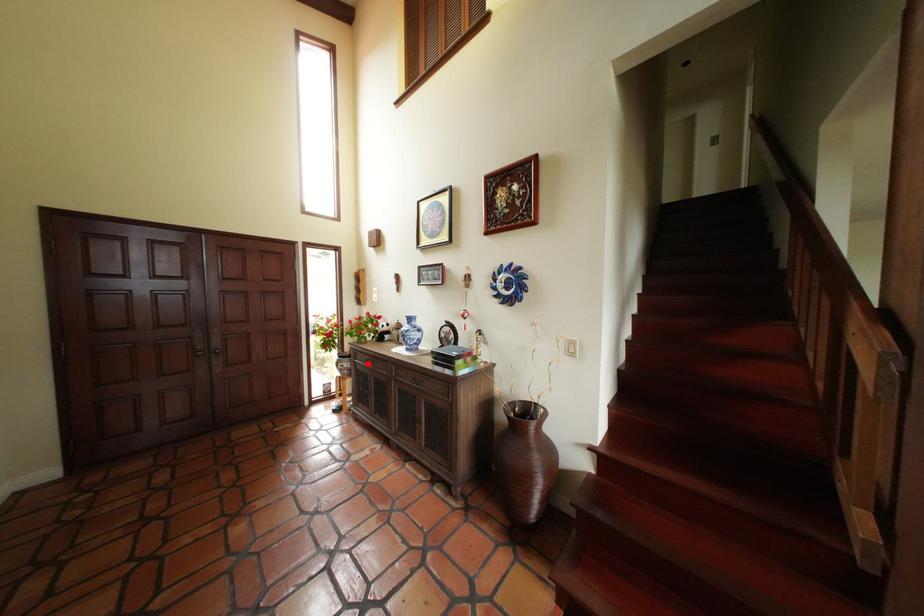
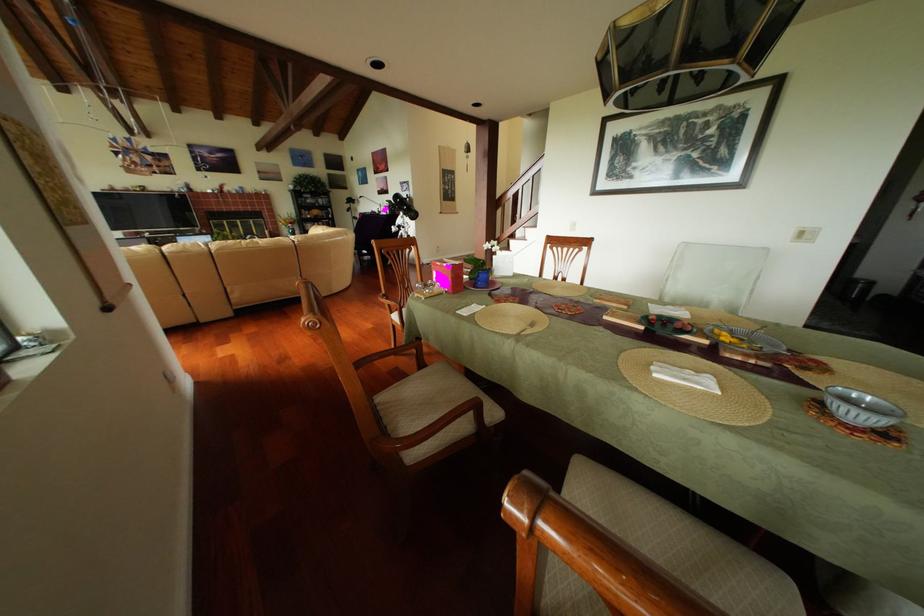
Question: I am providing you with two images of the same scene from different viewpoints. A red point is marked on the first image. Is the red point's position out of view in image 2?

Choices:
 (A) Yes
 (B) No

Answer: (A)